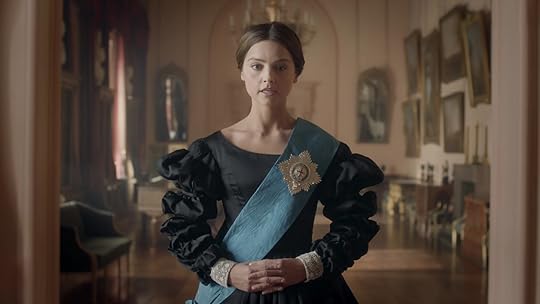
The height and width of the screenshot is (304, 540). What are the coordinates of `chair` in the screenshot? It's located at point(86,244).